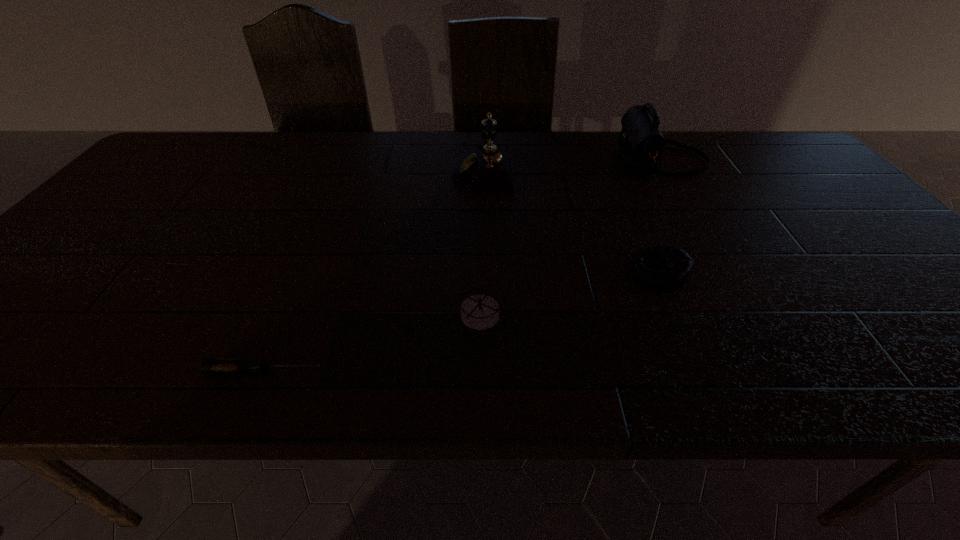
Locate an element on the screen. Image resolution: width=960 pixels, height=540 pixels. shoulder bag is located at coordinates (642, 144).

Find the location of a particular element. Image resolution: width=960 pixels, height=540 pixels. telephone is located at coordinates (488, 170).

The width and height of the screenshot is (960, 540). Identify the location of the third nearest object. (662, 268).

Identify the location of the second nearest object. (479, 312).

Locate an element on the screen. This screenshot has width=960, height=540. the leftmost object is located at coordinates (209, 365).

The width and height of the screenshot is (960, 540). I want to click on the shortest object, so click(x=209, y=365).

At what (x,y) coordinates should I click in order to perform the action: click on vacant area situated 0.100m on the left of the shoulder bag. Please return your answer as a coordinate pair (x, y). Looking at the image, I should click on (585, 160).

Image resolution: width=960 pixels, height=540 pixels. I want to click on free spot located 0.240m on the dial of the telephone, so click(x=372, y=169).

Locate an element on the screen. Image resolution: width=960 pixels, height=540 pixels. free space located on the dial of the telephone is located at coordinates (375, 169).

The image size is (960, 540). I want to click on free space located 0.360m on the dial of the telephone, so click(x=332, y=169).